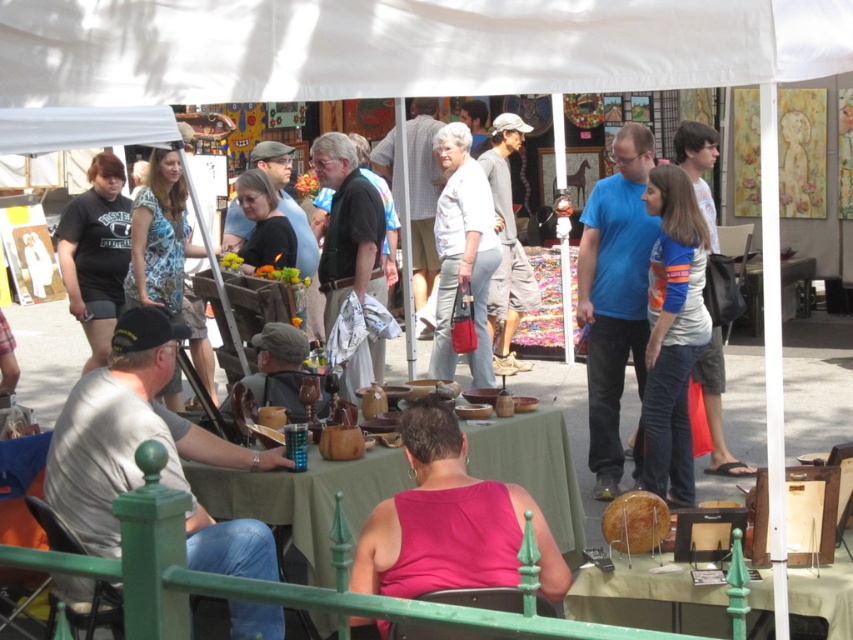
Between wooden sphere at center and white cotton shirt at center, which one has more height?

white cotton shirt at center is taller.

Can you confirm if wooden sphere at center is taller than white cotton shirt at center?

No.

Is point (788, 584) behind point (450, 138)?

That is False.

The width and height of the screenshot is (853, 640). In order to click on wooden sphere at center in this screenshot , I will do `click(648, 598)`.

Who is higher up, blue jersey at center or gray cotton shirt at center?

gray cotton shirt at center

Find the location of a particular element. The width and height of the screenshot is (853, 640). blue jersey at center is located at coordinates pyautogui.click(x=672, y=333).

The width and height of the screenshot is (853, 640). What do you see at coordinates (96, 253) in the screenshot? I see `black cotton t-shirt at left` at bounding box center [96, 253].

Can you confirm if black cotton t-shirt at left is positioned to the right of gray cotton shirt at center?

In fact, black cotton t-shirt at left is to the left of gray cotton shirt at center.

This screenshot has height=640, width=853. Describe the element at coordinates (96, 253) in the screenshot. I see `black cotton t-shirt at left` at that location.

This screenshot has width=853, height=640. In order to click on black cotton t-shirt at left in this screenshot , I will do pos(96,253).